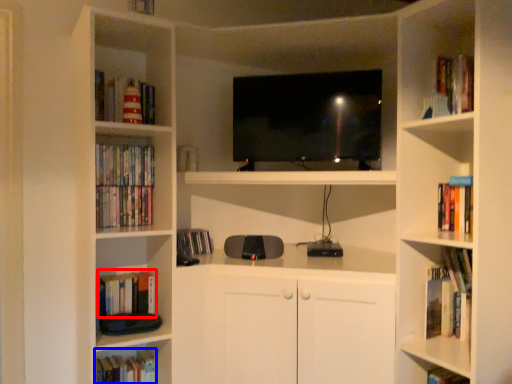
Question: Which of the following is the farthest to the observer, book (highlighted by a red box) or book (highlighted by a blue box)?

Choices:
 (A) book
 (B) book

Answer: (B)